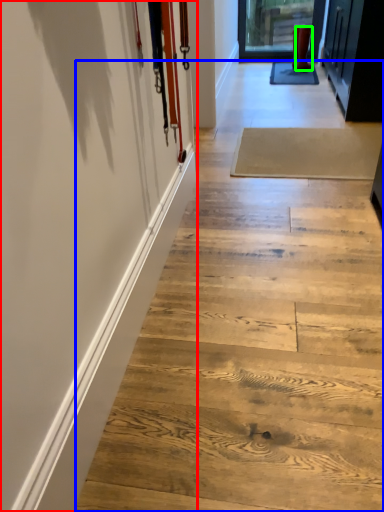
Question: Which is nearer to the barn door (highlighted by a red box)? stair (highlighted by a blue box) or footwear (highlighted by a green box).

Choices:
 (A) stair
 (B) footwear

Answer: (A)